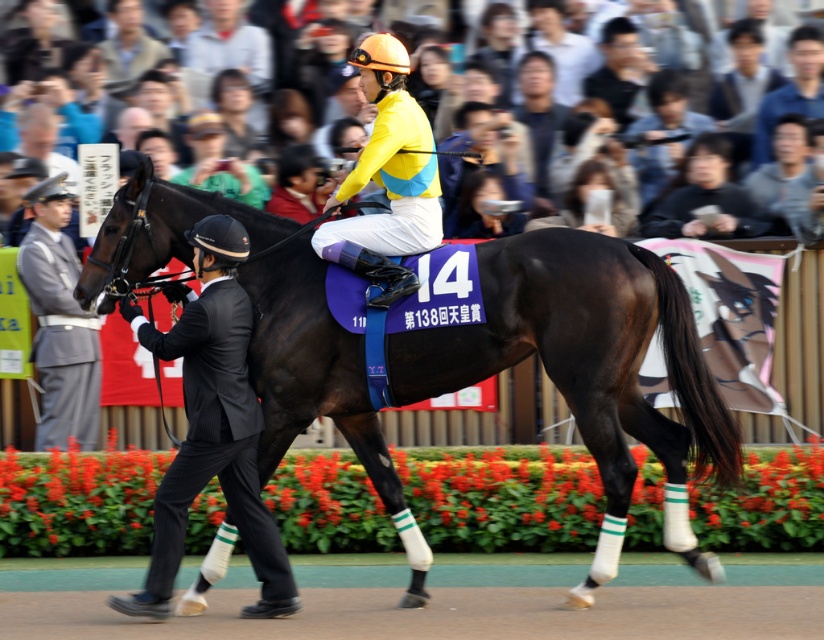
Question: Can you confirm if yellow matte/jersey at center is positioned to the left of gray uniform at left?

Choices:
 (A) no
 (B) yes

Answer: (A)

Question: Considering the real-world distances, which object is closest to the gray uniform at left?

Choices:
 (A) dirt track at center
 (B) shiny dark brown horse at center
 (C) yellow matte/jersey at center

Answer: (B)

Question: Does black suit at left appear under gray uniform at left?

Choices:
 (A) no
 (B) yes

Answer: (B)

Question: Estimate the real-world distances between objects in this image. Which object is farther from the shiny dark brown horse at center?

Choices:
 (A) black suit at left
 (B) yellow matte/jersey at center

Answer: (B)

Question: Which object is closer to the camera taking this photo?

Choices:
 (A) smooth skin crowd at upper center
 (B) shiny dark brown horse at center
 (C) gray uniform at left
 (D) dirt track at center

Answer: (D)

Question: Does shiny dark brown horse at center appear on the right side of dirt track at center?

Choices:
 (A) no
 (B) yes

Answer: (B)